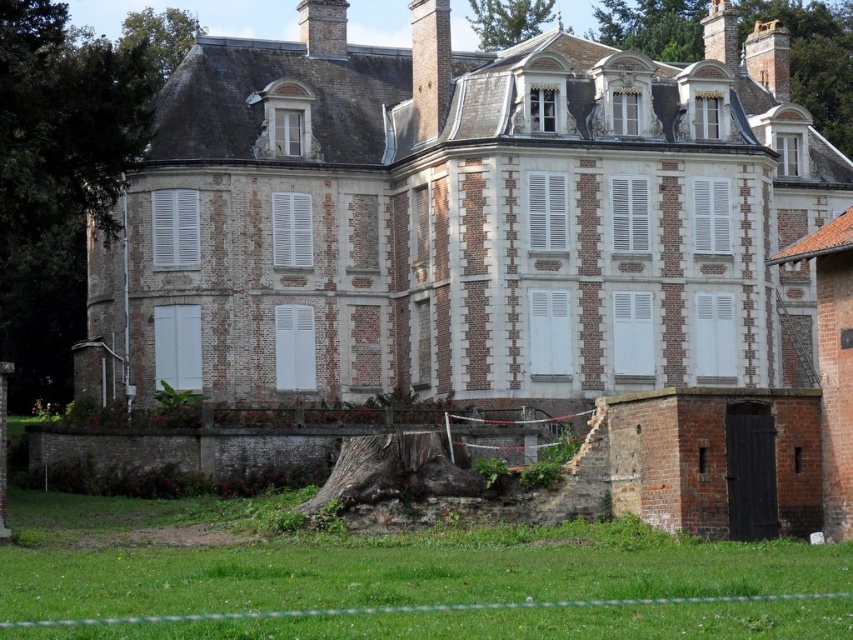
Question: Which is farther from the brick chimney at upper center?

Choices:
 (A) smooth stone chimney at upper right
 (B) smooth brick chimney at upper right

Answer: (B)

Question: Is brick chimney at upper center wider than smooth brick chimney at upper right?

Choices:
 (A) no
 (B) yes

Answer: (A)

Question: Can you confirm if brick chimney at upper center is bigger than smooth brick chimney at upper right?

Choices:
 (A) no
 (B) yes

Answer: (A)

Question: Which object is farther from the camera taking this photo?

Choices:
 (A) smooth brick chimney at upper right
 (B) smooth stone chimney at upper right

Answer: (A)

Question: Based on their relative distances, which object is nearer to the brick chimney at upper center?

Choices:
 (A) smooth brick chimney at upper right
 (B) smooth gray chimney at upper center

Answer: (B)

Question: Where is smooth brick chimney at upper right located in relation to smooth gray chimney at upper center in the image?

Choices:
 (A) right
 (B) left

Answer: (A)